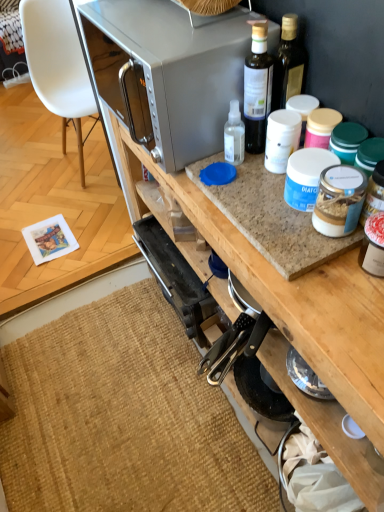
I want to click on vacant area situated to the left side of white plastic chair at left, so click(x=36, y=174).